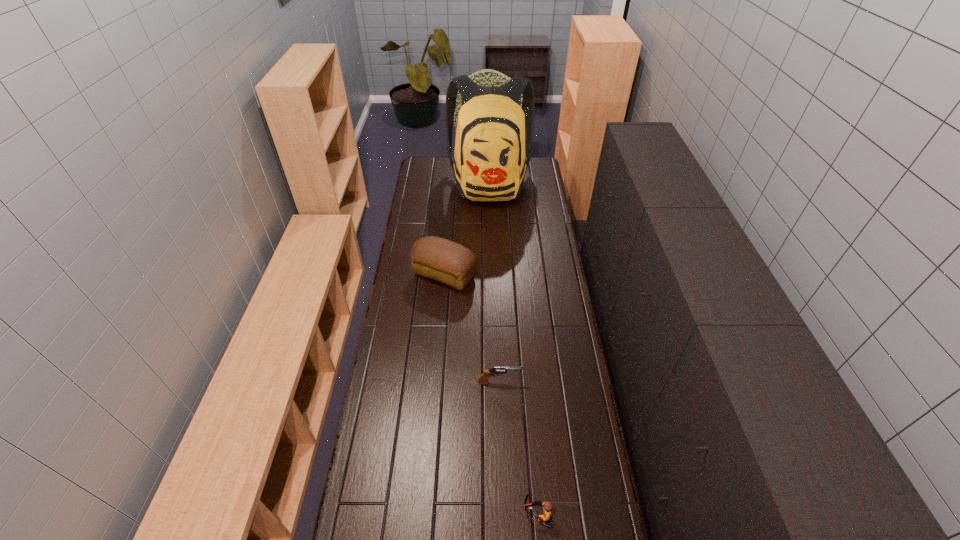
Identify which object is the second nearest to the third nearest object. Please provide its 2D coordinates. Your answer should be formatted as a tuple, i.e. [(x, y)], where the tuple contains the x and y coordinates of a point satisfying the conditions above.

[(483, 379)]